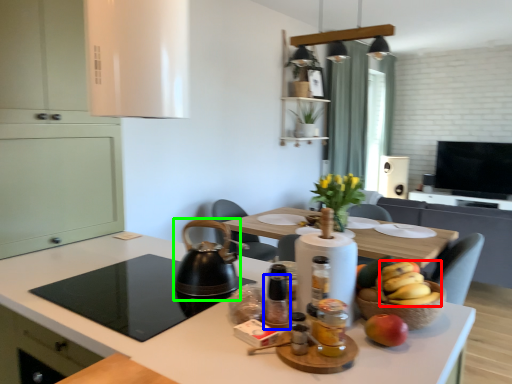
Question: Estimate the real-world distances between objects in this image. Which object is farther from banana (highlighted by a red box), bottle (highlighted by a blue box) or tea pot (highlighted by a green box)?

Choices:
 (A) bottle
 (B) tea pot

Answer: (B)